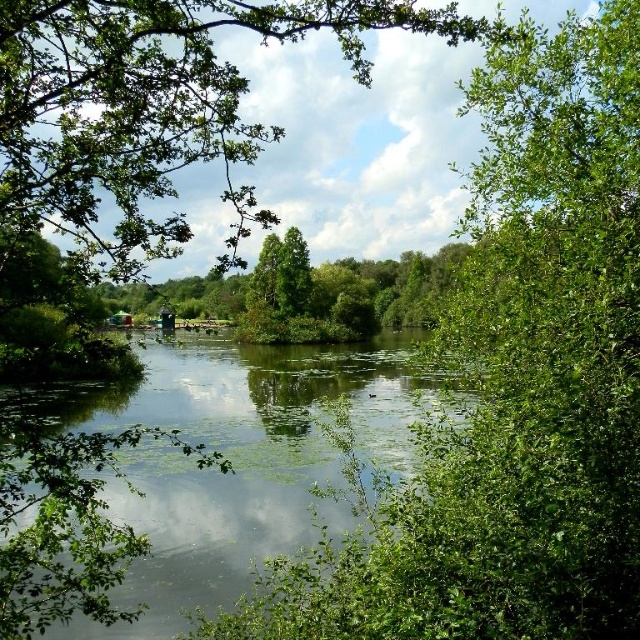
You are standing in the serene natural scene and want to take a photo of both the green leafy tree at upper center and the green leafy river at center. Which object should you focus on first to ensure both are in clear view?

You should focus on the green leafy tree at upper center first because it is closer to you than the green leafy river at center. By focusing on the closer object, you can ensure both are in clear view through proper depth of field adjustment.

You are standing on a wooden deck overlooking the green leafy river at center. If you want to throw a pebble into the water, will you need to throw it more than 3 meters?

The green leafy river at center is 3.30 meters away from the viewer. Therefore, you will need to throw the pebble more than 3 meters to reach it.